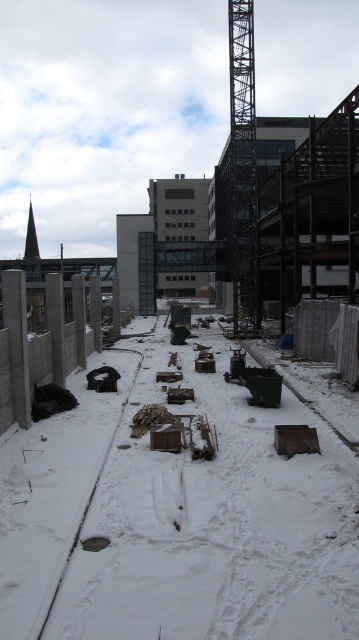
Question: Which point is closer to the camera?

Choices:
 (A) (234, 177)
 (B) (36, 616)
 (C) (21, 344)
 (D) (188, 406)

Answer: (B)

Question: In this image, where is rusty metal debris at center located relative to black rubber train track at lower left?

Choices:
 (A) above
 (B) below

Answer: (A)

Question: Can you confirm if black metal crane at center is positioned above concrete at left?

Choices:
 (A) yes
 (B) no

Answer: (A)

Question: Does black metal crane at center appear on the left side of concrete at left?

Choices:
 (A) no
 (B) yes

Answer: (A)

Question: Which point is farther to the camera?

Choices:
 (A) rusty metal debris at center
 (B) black metal crane at center

Answer: (B)

Question: Which point is farther to the camera?

Choices:
 (A) tap(67, 472)
 (B) tap(252, 189)
 (C) tap(15, 348)

Answer: (B)